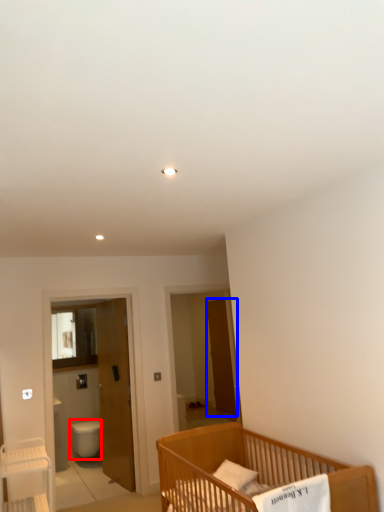
Question: Which object is closer to the camera taking this photo, toilet bowl (highlighted by a red box) or screen door (highlighted by a blue box)?

Choices:
 (A) toilet bowl
 (B) screen door

Answer: (A)